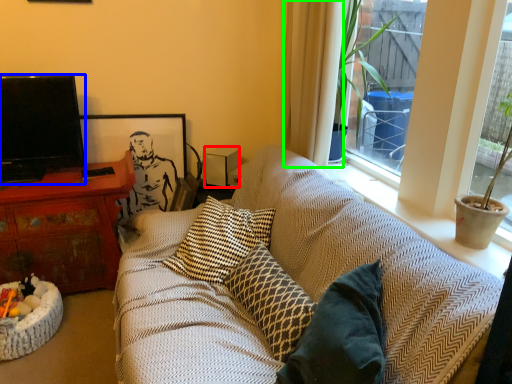
Question: Which is farther away from loudspeaker (highlighted by a red box)? television (highlighted by a blue box) or curtain (highlighted by a green box)?

Choices:
 (A) television
 (B) curtain

Answer: (A)